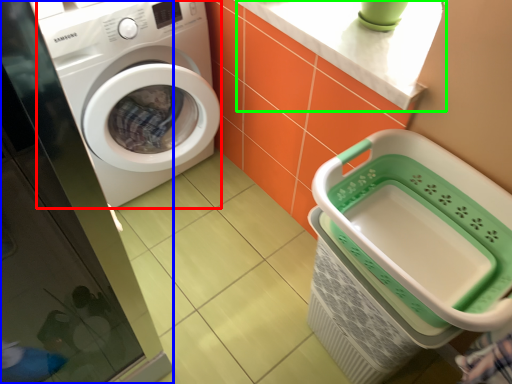
Question: Based on their relative distances, which object is farther from washing machine (highlighted by a red box)? Choose from screen door (highlighted by a blue box) and counter top (highlighted by a green box).

Choices:
 (A) screen door
 (B) counter top

Answer: (B)